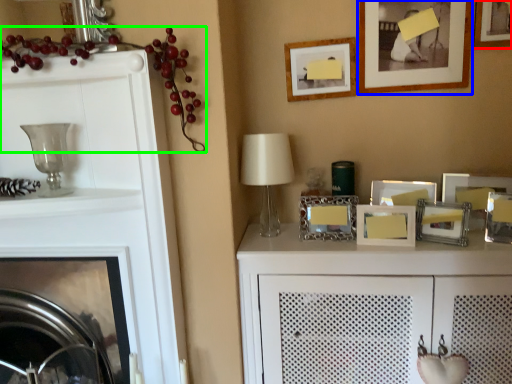
Question: Which object is positioned closest to picture frame (highlighted by a red box)? Select from picture frame (highlighted by a blue box) and fruit (highlighted by a green box).

Choices:
 (A) picture frame
 (B) fruit

Answer: (A)